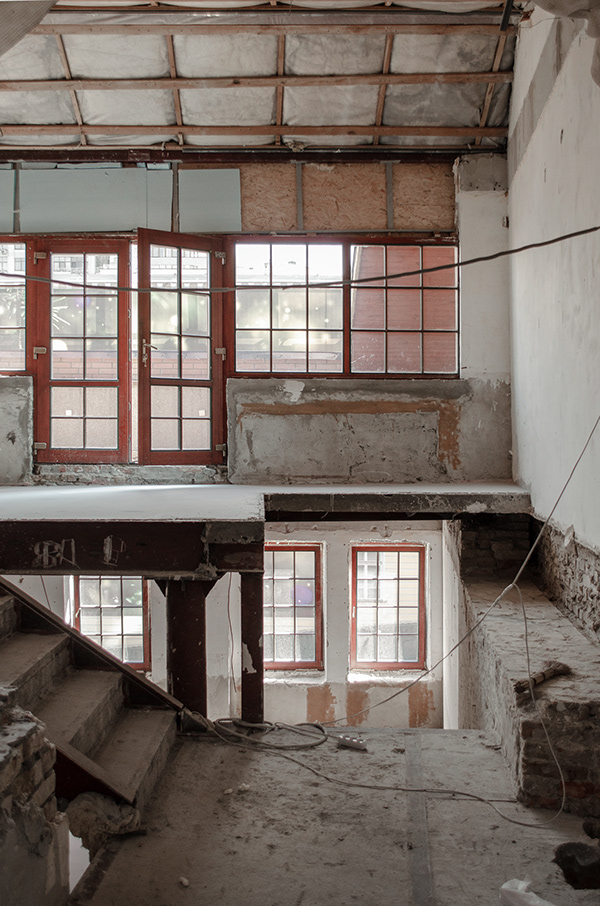
Where is `cable`? cable is located at coordinates (456, 646).